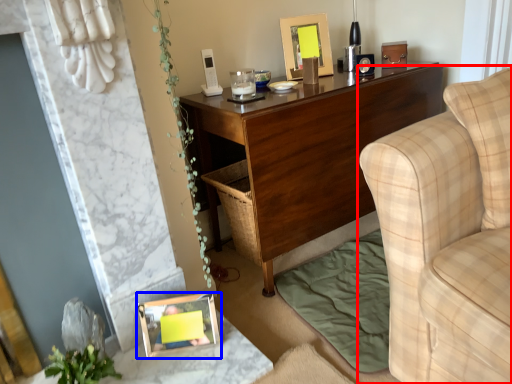
Question: Among these objects, which one is farthest to the camera, studio couch (highlighted by a red box) or picture frame (highlighted by a blue box)?

Choices:
 (A) studio couch
 (B) picture frame

Answer: (B)